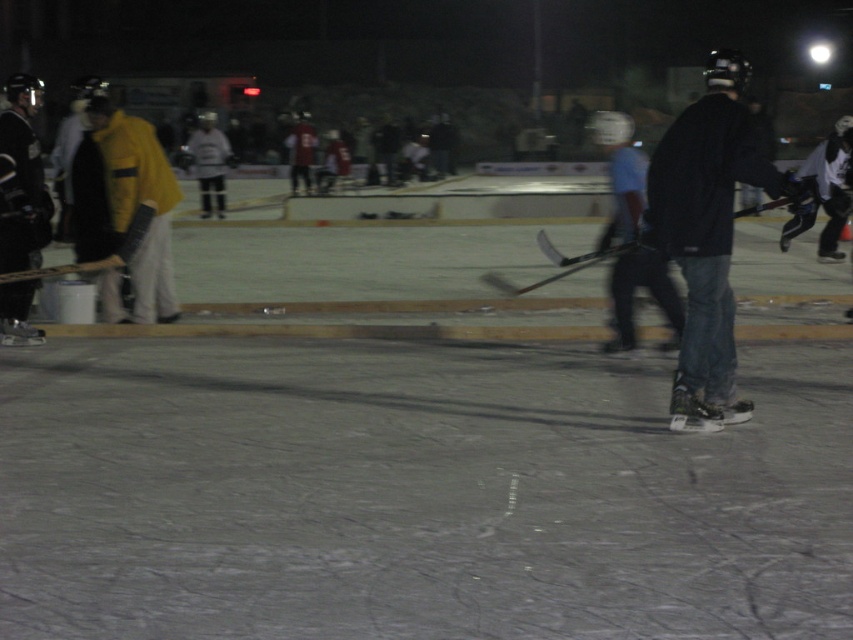
Can you confirm if matte black hockey stick at center is thinner than black matte hockey stick at center?

Correct, matte black hockey stick at center's width is less than black matte hockey stick at center's.

Who is positioned more to the left, matte black hockey stick at center or black matte hockey stick at center?

From the viewer's perspective, black matte hockey stick at center appears more on the left side.

The image size is (853, 640). What are the coordinates of `matte black hockey stick at center` in the screenshot? It's located at (621, 173).

Between point (93, 104) and point (207, 211), which one is positioned behind?

The point (207, 211) is behind.

Can you confirm if yellow matte jacket at left is bigger than white matte hockey player at upper center?

Incorrect, yellow matte jacket at left is not larger than white matte hockey player at upper center.

The image size is (853, 640). Find the location of `yellow matte jacket at left`. yellow matte jacket at left is located at coordinates (125, 209).

Is point (724, 115) less distant than point (202, 157)?

Yes, point (724, 115) is in front of point (202, 157).

The image size is (853, 640). Describe the element at coordinates (706, 234) in the screenshot. I see `black matte jacket at right` at that location.

Is point (668, 248) positioned before point (219, 132)?

Yes, it is.

The image size is (853, 640). I want to click on black matte jacket at right, so click(706, 234).